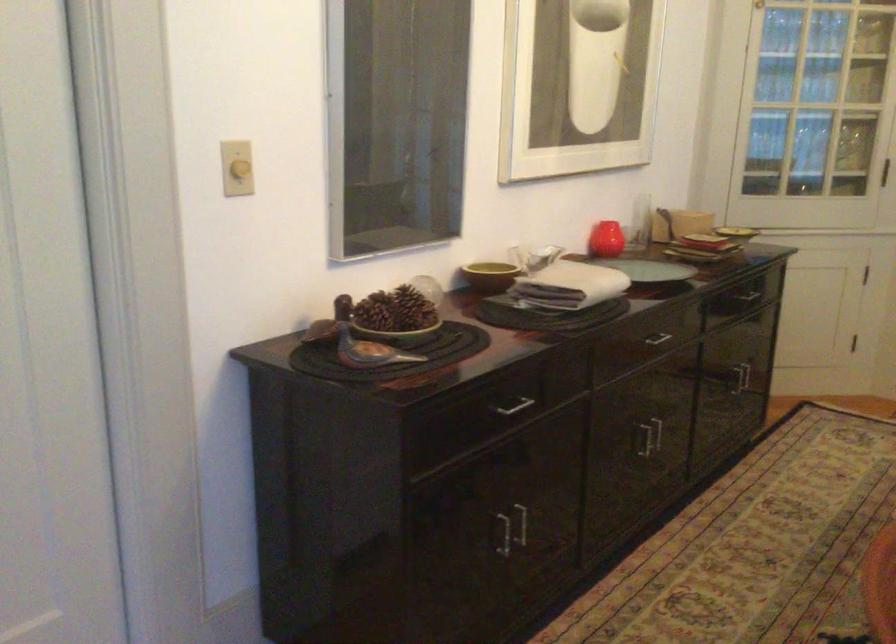
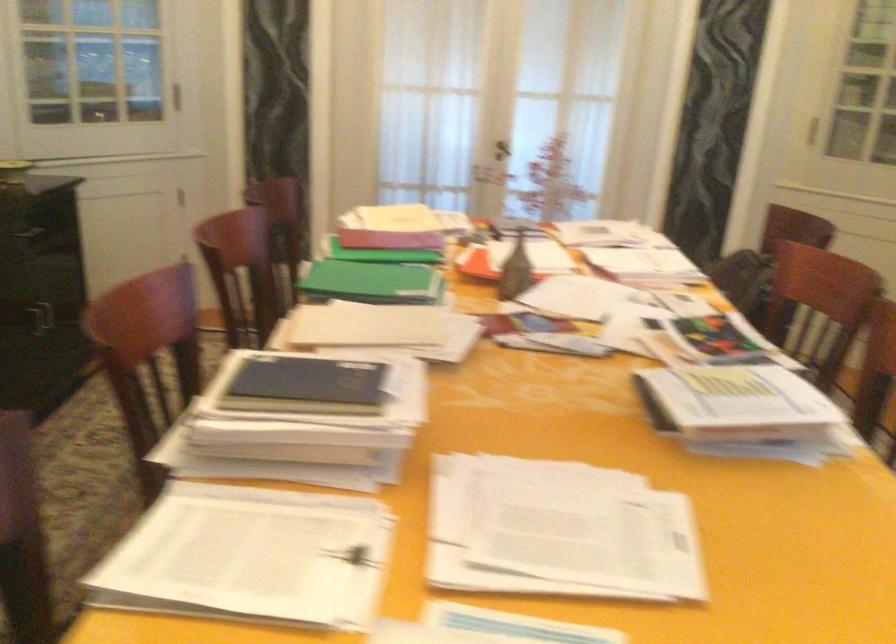
Question: The first image is from the beginning of the video and the second image is from the end. How did the camera likely rotate when shooting the video?

Choices:
 (A) Left
 (B) Right
 (C) Up
 (D) Down

Answer: (B)